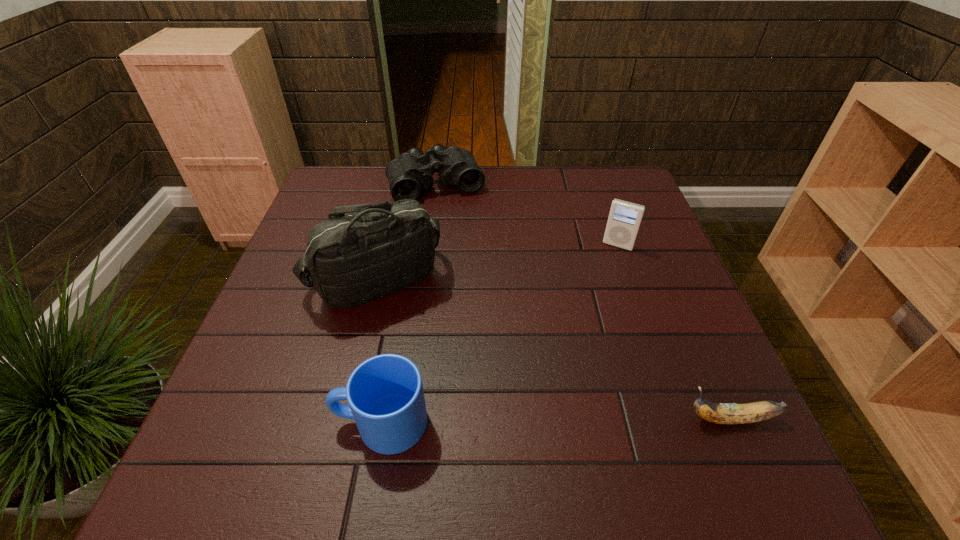
Image resolution: width=960 pixels, height=540 pixels. Find the location of `free space that is in between the shortest object and the mug`. free space that is in between the shortest object and the mug is located at coordinates (556, 421).

This screenshot has width=960, height=540. What are the coordinates of `free space between the shortest object and the binoculars` in the screenshot? It's located at (583, 302).

At what (x,y) coordinates should I click in order to perform the action: click on vacant space that is in between the iPod and the binoculars. Please return your answer as a coordinate pair (x, y). Image resolution: width=960 pixels, height=540 pixels. Looking at the image, I should click on (527, 215).

Image resolution: width=960 pixels, height=540 pixels. Find the location of `the third closest object relative to the tallest object`. the third closest object relative to the tallest object is located at coordinates (624, 220).

Find the location of `the third closest object to the binoculars`. the third closest object to the binoculars is located at coordinates (385, 394).

Find the location of a particular element. free region that satisfies the following two spatial constraints: 1. on the front side of the banana; 2. at the stem of the binoculars is located at coordinates [406, 419].

The height and width of the screenshot is (540, 960). I want to click on vacant space that satisfies the following two spatial constraints: 1. on the front side of the iPod; 2. on the left side of the farthest object, so click(428, 246).

Where is `vacant region that satisfies the following two spatial constraints: 1. on the front side of the shortest object; 2. at the stem of the iPod`? This screenshot has width=960, height=540. vacant region that satisfies the following two spatial constraints: 1. on the front side of the shortest object; 2. at the stem of the iPod is located at coordinates (678, 419).

Where is `vacant position in the image that satisfies the following two spatial constraints: 1. on the front side of the iPod; 2. at the stem of the banana`? The image size is (960, 540). vacant position in the image that satisfies the following two spatial constraints: 1. on the front side of the iPod; 2. at the stem of the banana is located at coordinates coord(678,419).